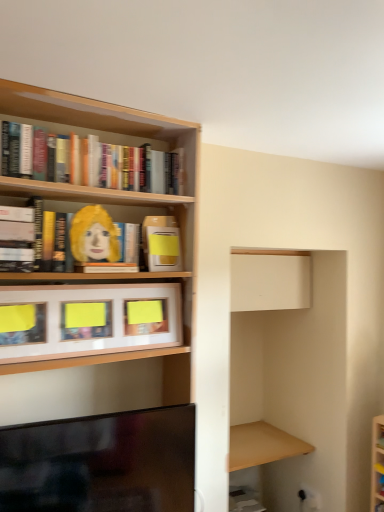
This screenshot has height=512, width=384. Identify the location of vacant area situated below white matte cabinet at upper center, the 1th cabinet viewed from the back (from a real-world perspective). (260, 440).